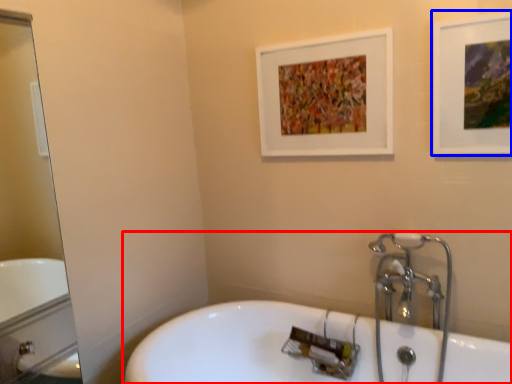
Question: Which point is further to the camera, bathtub (highlighted by a red box) or picture frame (highlighted by a blue box)?

Choices:
 (A) bathtub
 (B) picture frame

Answer: (B)